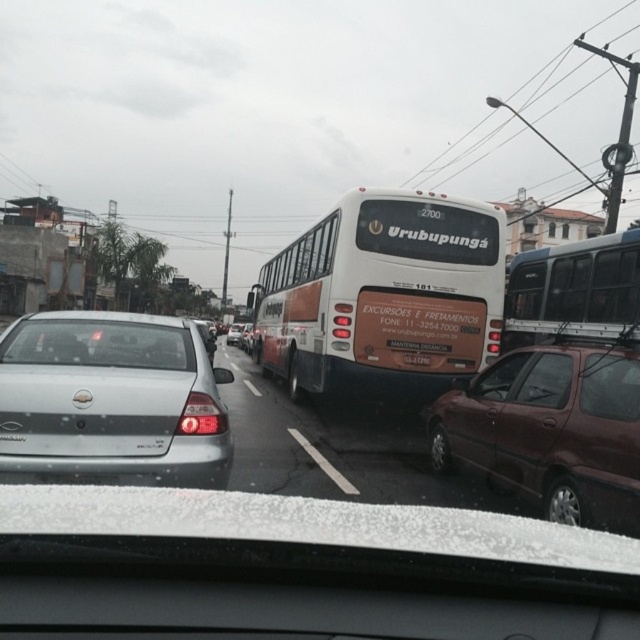
Is point (49, 356) more distant than point (618, 236)?

No, (49, 356) is closer to viewer.

Between satin silver sedan at left and white matte van at right, which one is positioned higher?

Positioned higher is white matte van at right.

Is point (92, 401) closer to camera compared to point (540, 340)?

Yes, it is in front of point (540, 340).

At what (x,y) coordinates should I click in order to perform the action: click on satin silver sedan at left. Please return your answer as a coordinate pair (x, y). The image size is (640, 640). Looking at the image, I should click on (112, 400).

Looking at this image, who is positioned more to the left, white matte bus at center or clear glass windshield at center?

From the viewer's perspective, clear glass windshield at center appears more on the left side.

Between point (362, 323) and point (88, 360), which one is positioned in front?

Point (88, 360) is more forward.

Describe the element at coordinates (381, 296) in the screenshot. I see `white matte bus at center` at that location.

Image resolution: width=640 pixels, height=640 pixels. I want to click on white matte bus at center, so click(x=381, y=296).

Between white matte bus at center and satin silver sedan at left, which one is positioned higher?

white matte bus at center

Can you confirm if white matte bus at center is wider than satin silver sedan at left?

Yes.

Which is in front, point (442, 337) or point (220, 458)?

Positioned in front is point (220, 458).

Identify the location of white matte bus at center. This screenshot has height=640, width=640. (381, 296).